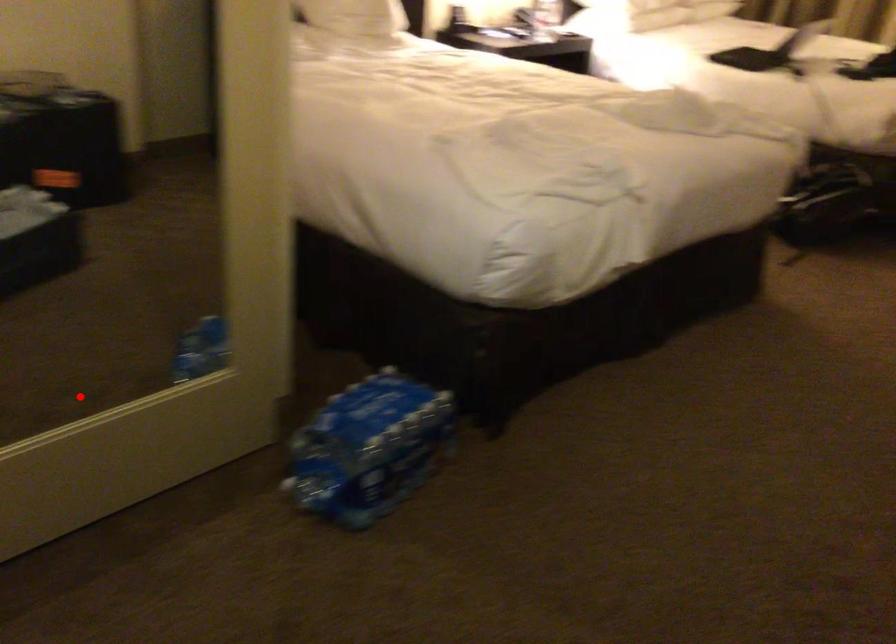
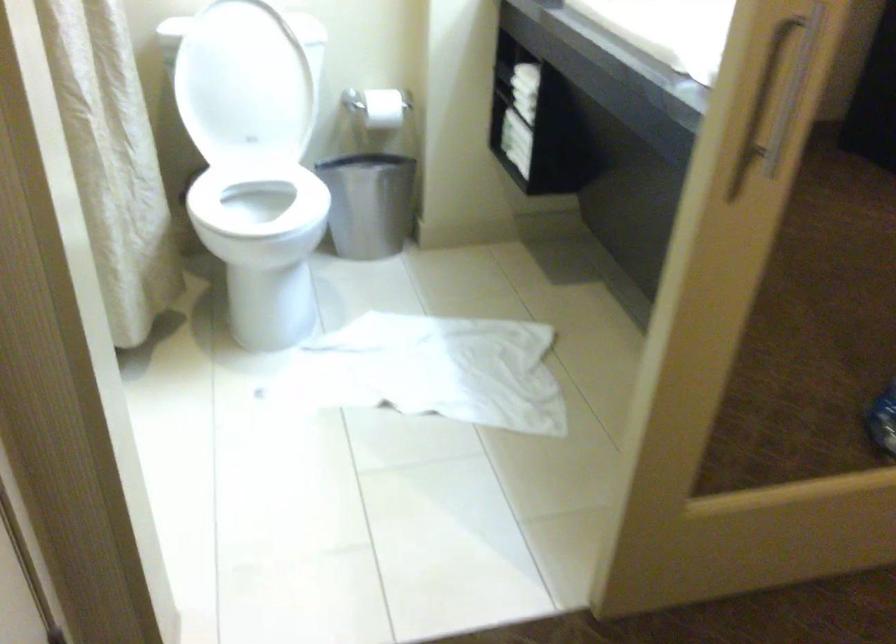
Question: I am providing you with two images of the same scene from different viewpoints. A red point is shown in image1. For the corresponding object point in image2, is it positioned nearer or farther from the camera?

Choices:
 (A) Nearer
 (B) Farther

Answer: (A)